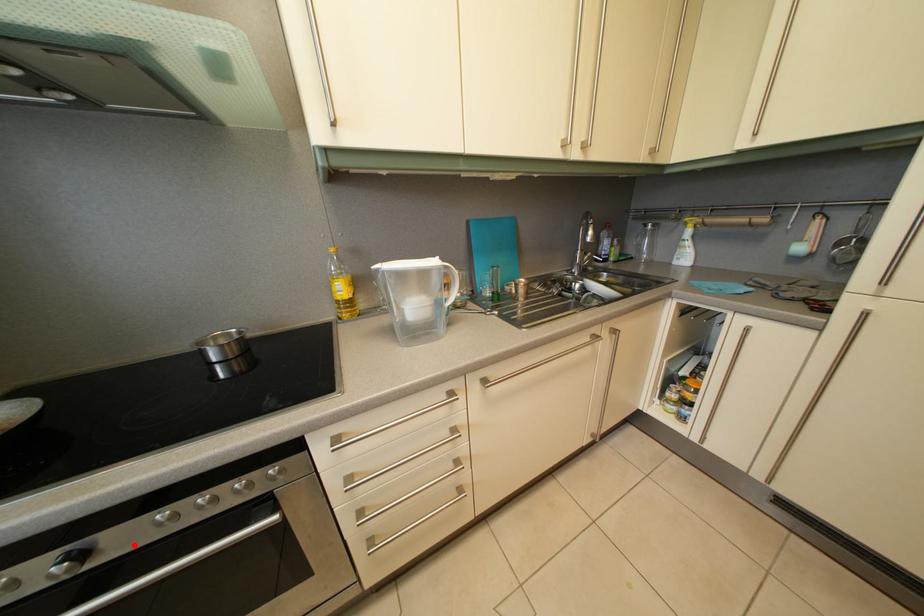
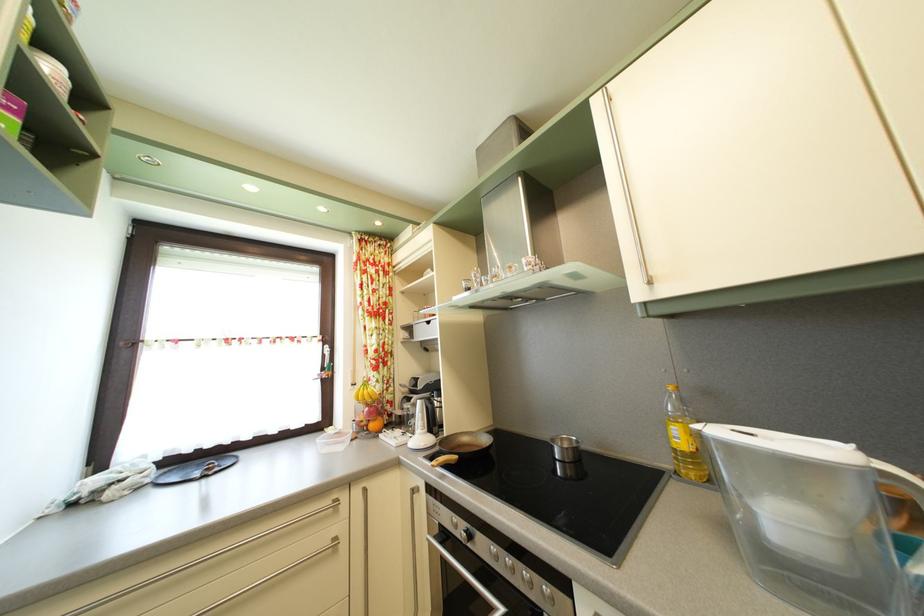
Locate, in the second image, the point that corresponds to the highlighted location in the first image.

(490, 553)